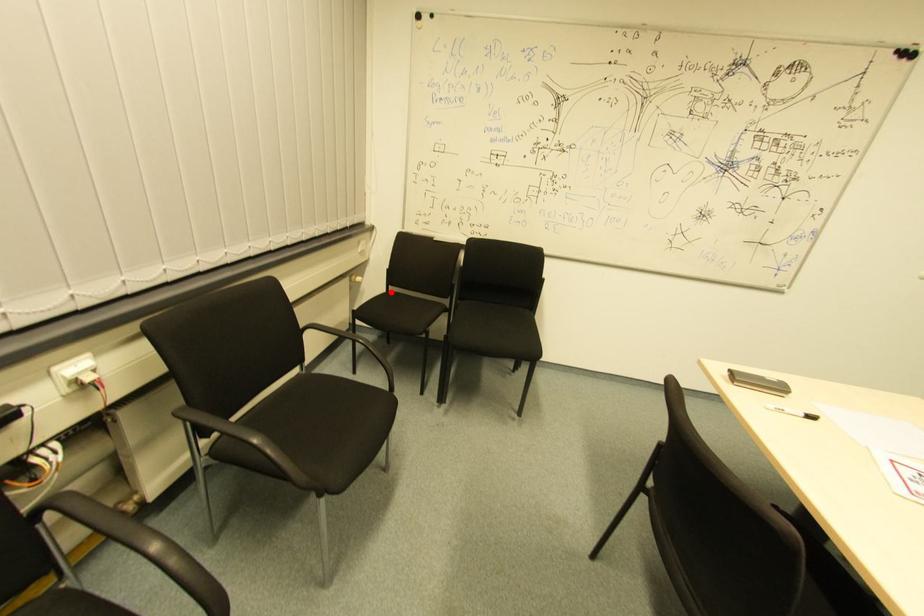
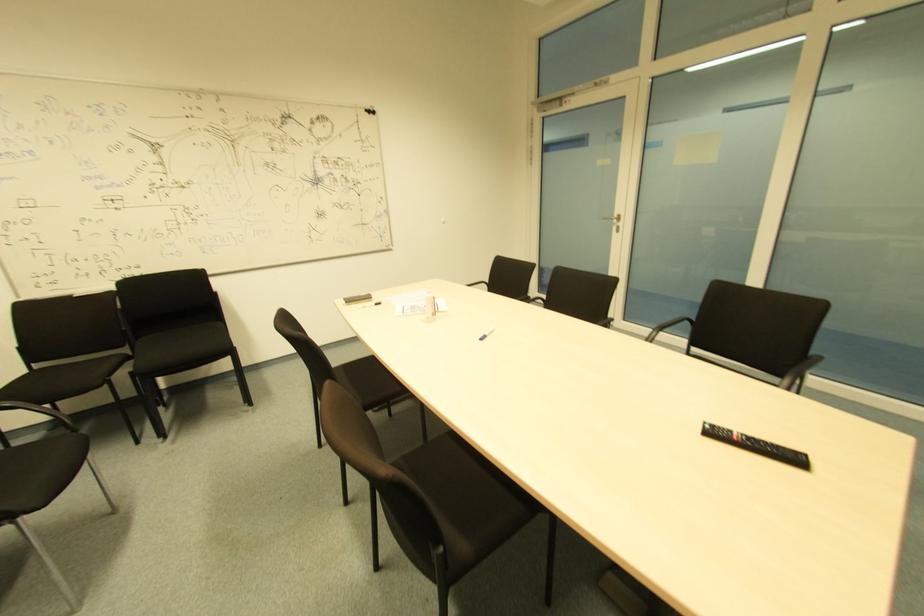
Where in the second image is the point corresponding to the highlighted location from the first image?

(34, 370)